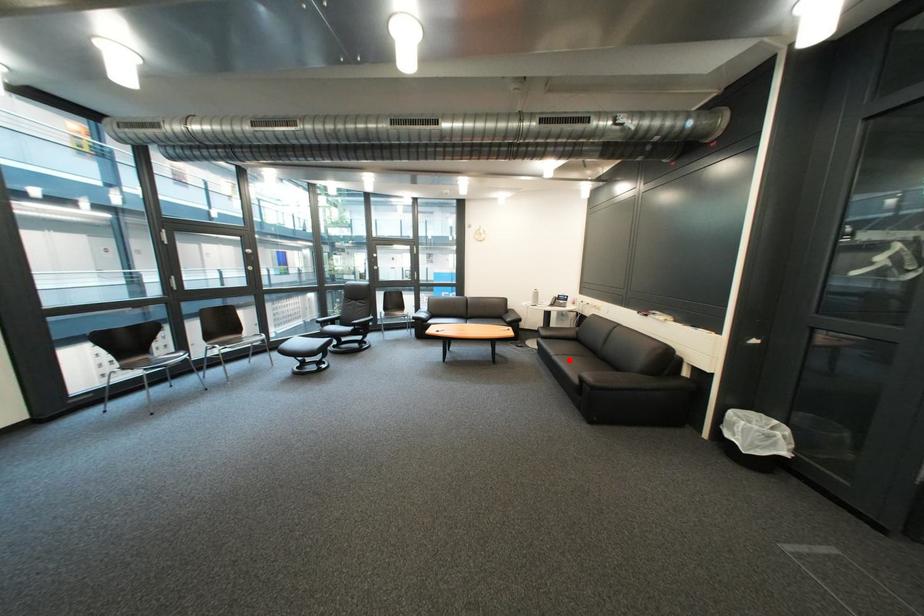
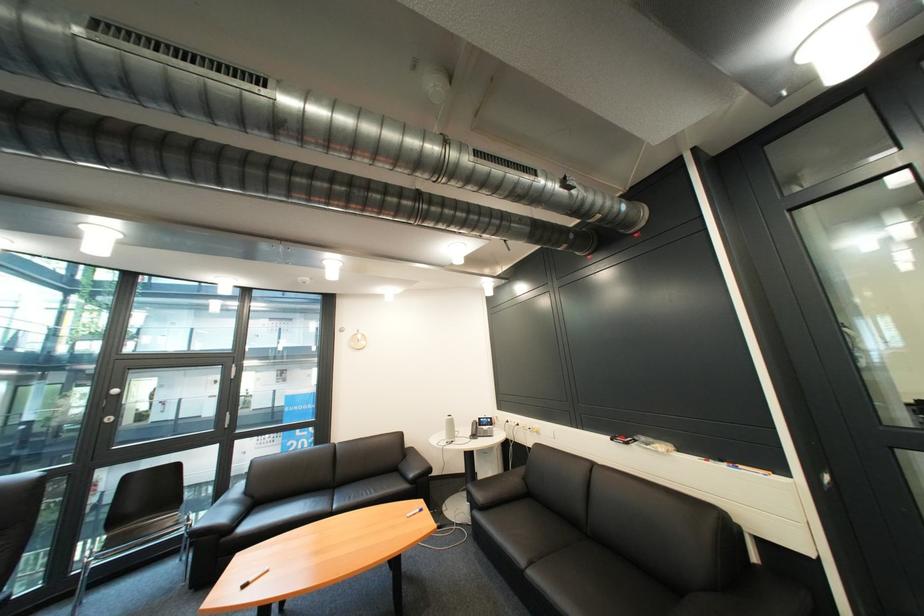
Question: A red point is marked in image1. In image2, is the corresponding 3D point closer to the camera or farther? Reply with the corresponding letter.

Choices:
 (A) The corresponding 3D point is closer.
 (B) The corresponding 3D point is farther.

Answer: (B)